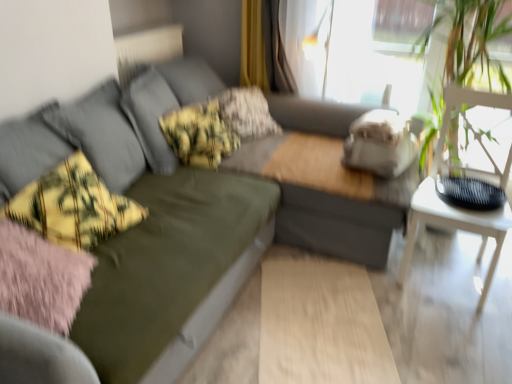
Where is `free location in front of white wooden table at right`? The height and width of the screenshot is (384, 512). free location in front of white wooden table at right is located at coordinates (456, 322).